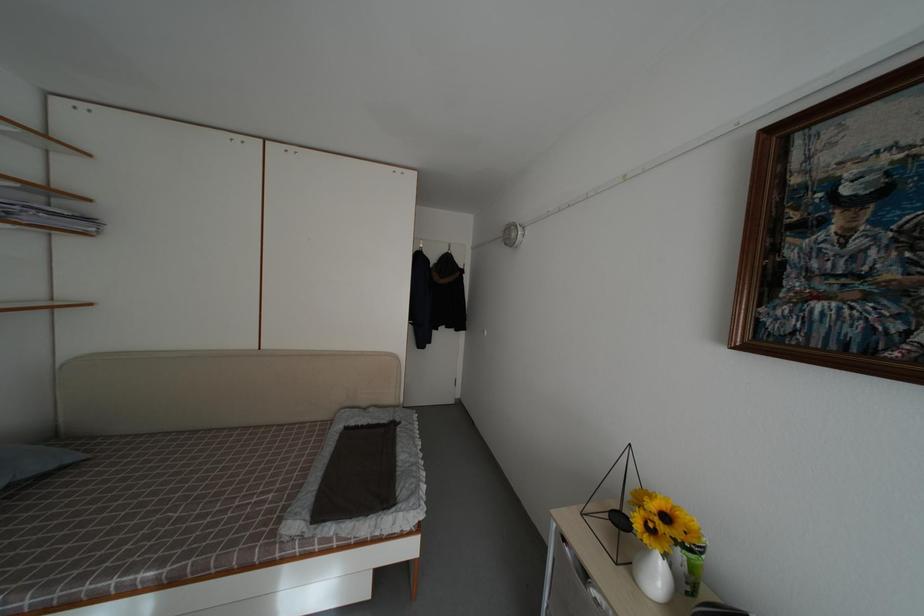
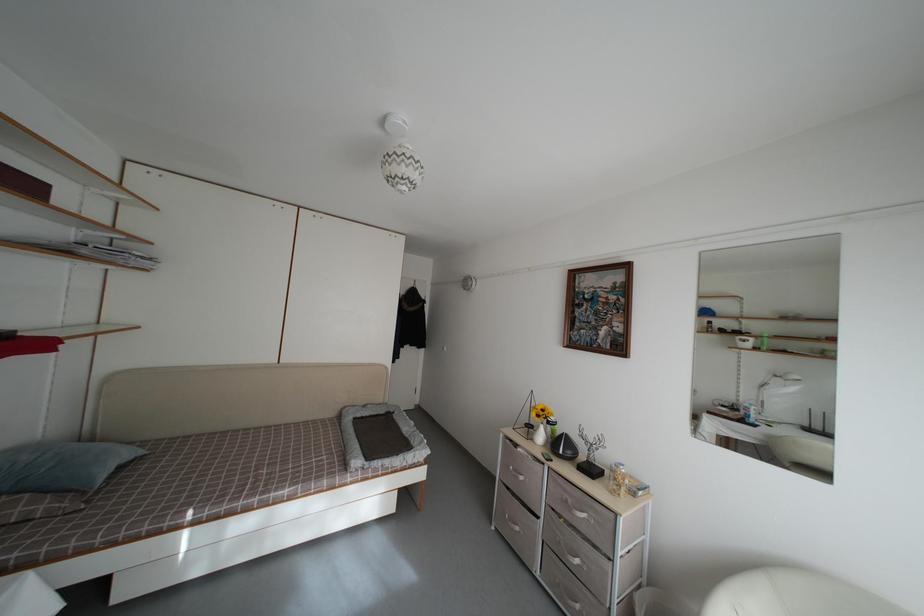
Question: Based on the continuous images, in which direction is the camera rotating? Reply with the corresponding letter.

Choices:
 (A) Left
 (B) Right
 (C) Up
 (D) Down

Answer: (B)